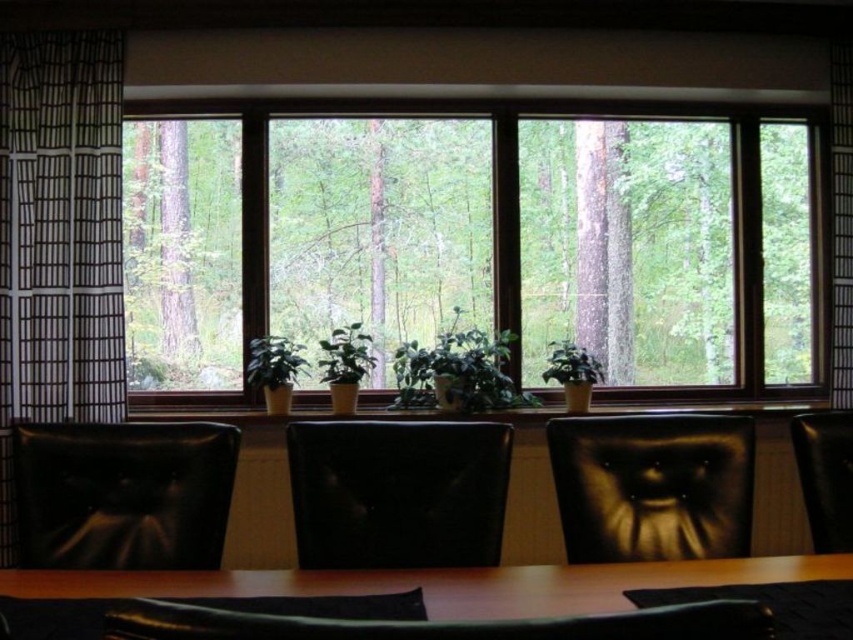
You are sitting in the dark brown leather armchair at center and want to reach the brown wooden table at center to grab a book. In which direction should you move?

You should move to your left because the dark brown leather armchair at center is to the right of the brown wooden table at center.

Based on the photo, you are sitting in the black leather armchair at center and want to see the green matte plant at center. Which direction should you look to see it?

The green matte plant at center is behind the black leather armchair at center, so you should look behind yourself to see it.

You are standing at the entrance of the room and want to sit down in the black leather armchair at center. Which direction should you walk to reach it?

The black leather armchair at center is located at point coordinates, so you should walk towards the center of the room to reach it.